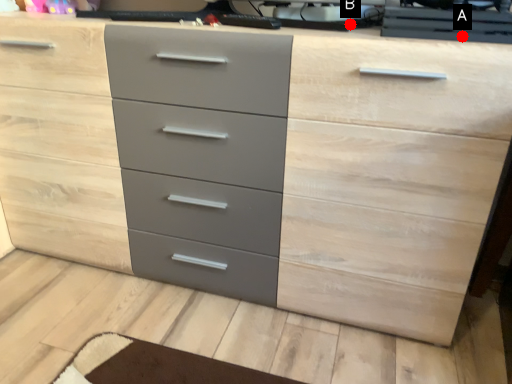
Question: Two points are circled on the image, labeled by A and B beside each circle. Which point is farther to the camera?

Choices:
 (A) A is further
 (B) B is further

Answer: (B)